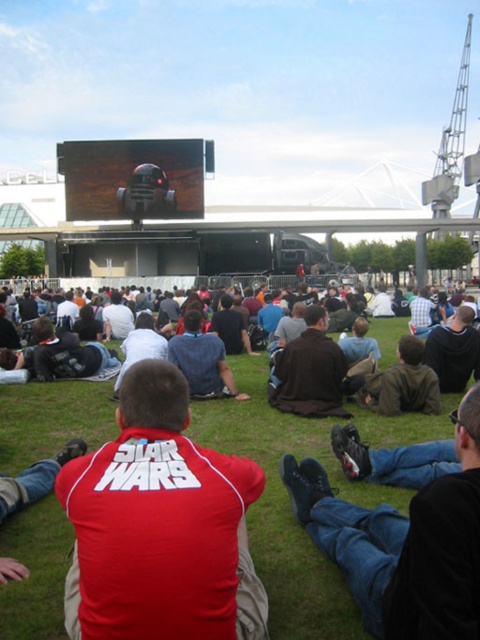
Between dark brown jacket at center and brown leather jacket at center, which one appears on the right side from the viewer's perspective?

brown leather jacket at center is more to the right.

Between dark brown jacket at center and brown leather jacket at center, which one has more height?

dark brown jacket at center

Does point (279, 396) lie behind point (416, 401)?

That is True.

You are a GUI agent. You are given a task and a screenshot of the screen. Output one action in this format:
    pyautogui.click(x=<x>, y=<y>)
    Task: Click on the dark brown jacket at center
    
    Given the screenshot: What is the action you would take?
    pyautogui.click(x=311, y=371)

Is point (291, 397) farther from viewer compared to point (186, 360)?

No, it is in front of (186, 360).

Is the position of dark brown jacket at center less distant than that of dark blue shirt at center?

Yes, it is.

What do you see at coordinates (311, 371) in the screenshot? I see `dark brown jacket at center` at bounding box center [311, 371].

Locate an element on the screen. Image resolution: width=480 pixels, height=640 pixels. dark brown jacket at center is located at coordinates pos(311,371).

Can you confirm if denim jeans at center is wider than dark blue shirt at center?

Correct, the width of denim jeans at center exceeds that of dark blue shirt at center.

Between point (387, 595) and point (217, 376), which one is positioned behind?

Positioned behind is point (217, 376).

Locate an element on the screen. This screenshot has width=480, height=640. denim jeans at center is located at coordinates (405, 541).